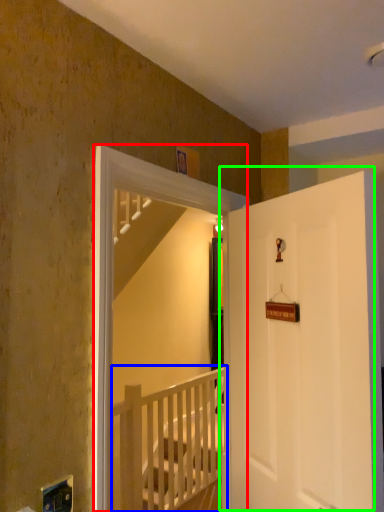
Question: Which object is the closest to the screen door (highlighted by a red box)? Choose among these: rail (highlighted by a blue box) or door (highlighted by a green box).

Choices:
 (A) rail
 (B) door

Answer: (B)